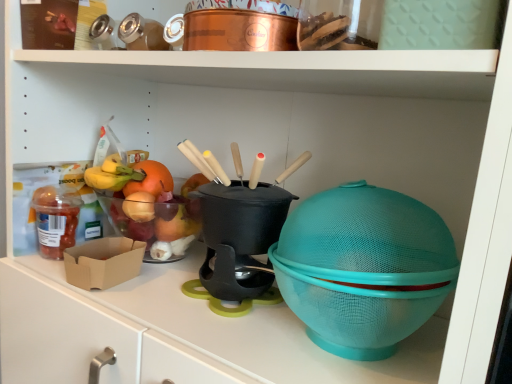
The image size is (512, 384). What do you see at coordinates (239, 239) in the screenshot?
I see `black plastic pot at center` at bounding box center [239, 239].

Measure the distance between black plastic pot at center and camera.

They are 25.57 inches apart.

Where is `black plastic pot at center`? The image size is (512, 384). black plastic pot at center is located at coordinates (239, 239).

Image resolution: width=512 pixels, height=384 pixels. Find the location of `translucent plastic container at left`. translucent plastic container at left is located at coordinates (55, 220).

The width and height of the screenshot is (512, 384). Describe the element at coordinates (55, 220) in the screenshot. I see `translucent plastic container at left` at that location.

Where is `black plastic pot at center`? black plastic pot at center is located at coordinates (239, 239).

Is black plastic pot at center at the left side of translucent plastic container at left?

No, black plastic pot at center is not to the left of translucent plastic container at left.

Considering the relative positions of black plastic pot at center and translucent plastic container at left in the image provided, is black plastic pot at center in front of translucent plastic container at left?

Yes, it is in front of translucent plastic container at left.

Considering the points (220, 228) and (42, 232), which point is in front, point (220, 228) or point (42, 232)?

Positioned in front is point (220, 228).

From the image's perspective, which is above, black plastic pot at center or translucent plastic container at left?

From the image's view, black plastic pot at center is above.

From a real-world perspective, is black plastic pot at center beneath translucent plastic container at left?

Incorrect, from a real-world perspective, black plastic pot at center is higher than translucent plastic container at left.

Which object is wider, black plastic pot at center or translucent plastic container at left?

With larger width is black plastic pot at center.

Which of these two, black plastic pot at center or translucent plastic container at left, stands shorter?

translucent plastic container at left.

From the picture: Which of these two, black plastic pot at center or translucent plastic container at left, is bigger?

Bigger between the two is black plastic pot at center.

Is translucent plastic container at left completely or partially inside black plastic pot at center?

Actually, translucent plastic container at left is outside black plastic pot at center.

Is black plastic pot at center touching translucent plastic container at left?

No, black plastic pot at center is not making contact with translucent plastic container at left.

Is black plastic pot at center aimed at translucent plastic container at left?

No, black plastic pot at center does not turn towards translucent plastic container at left.

Can you tell me how much black plastic pot at center and translucent plastic container at left differ in facing direction?

The angle between the facing direction of black plastic pot at center and the facing direction of translucent plastic container at left is 0.00435 degrees.

The height and width of the screenshot is (384, 512). In the image, there is a black plastic pot at center. In order to click on food below it (from a real-world perspective) in this screenshot , I will do `click(55, 220)`.

Considering the positions of objects translucent plastic container at left and black plastic pot at center in the image provided, who is more to the left, translucent plastic container at left or black plastic pot at center?

From the viewer's perspective, translucent plastic container at left appears more on the left side.

Relative to black plastic pot at center, is translucent plastic container at left in front or behind?

Visually, translucent plastic container at left is located behind black plastic pot at center.

Considering the points (40, 191) and (224, 290), which point is in front, point (40, 191) or point (224, 290)?

The point (224, 290) is closer.

From the image's perspective, which one is positioned higher, translucent plastic container at left or black plastic pot at center?

From the image's view, black plastic pot at center is above.

From a real-world perspective, which object rests below the other?

In real-world perspective, translucent plastic container at left is lower.

Is translucent plastic container at left wider or thinner than black plastic pot at center?

In the image, translucent plastic container at left appears to be more narrow than black plastic pot at center.

Can you confirm if translucent plastic container at left is shorter than black plastic pot at center?

Yes, translucent plastic container at left is shorter than black plastic pot at center.

Considering the sizes of translucent plastic container at left and black plastic pot at center in the image, is translucent plastic container at left bigger or smaller than black plastic pot at center?

translucent plastic container at left is smaller than black plastic pot at center.

Is translucent plastic container at left surrounding black plastic pot at center?

No, black plastic pot at center is not inside translucent plastic container at left.

Does translucent plastic container at left touch black plastic pot at center?

translucent plastic container at left and black plastic pot at center are not in contact.

Is translucent plastic container at left positioned with its back to black plastic pot at center?

translucent plastic container at left does not have its back to black plastic pot at center.

How many degrees apart are the facing directions of translucent plastic container at left and black plastic pot at center?

The facing directions of translucent plastic container at left and black plastic pot at center are 0.00435 degrees apart.

Where is `food below the black plastic pot at center (from a real-world perspective)`? This screenshot has height=384, width=512. food below the black plastic pot at center (from a real-world perspective) is located at coordinates (55, 220).

The image size is (512, 384). Find the location of `food that appears behind the black plastic pot at center`. food that appears behind the black plastic pot at center is located at coordinates [55, 220].

Where is `food below the black plastic pot at center (from the image's perspective)`? food below the black plastic pot at center (from the image's perspective) is located at coordinates (55, 220).